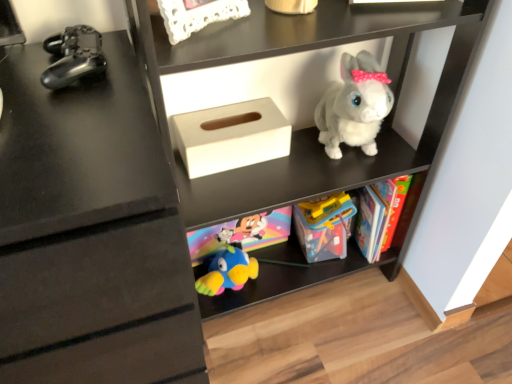
Question: Is white matte tissue box at center at the back of white matte plush rabbit at upper center?

Choices:
 (A) no
 (B) yes

Answer: (B)

Question: Is white matte plush rabbit at upper center touching white matte tissue box at center?

Choices:
 (A) yes
 (B) no

Answer: (B)

Question: Would you say white matte tissue box at center is part of white matte plush rabbit at upper center's contents?

Choices:
 (A) yes
 (B) no

Answer: (A)

Question: Is the position of white matte plush rabbit at upper center more distant than that of white matte tissue box at center?

Choices:
 (A) no
 (B) yes

Answer: (A)

Question: Can you confirm if white matte plush rabbit at upper center is bigger than white matte tissue box at center?

Choices:
 (A) yes
 (B) no

Answer: (A)

Question: From the image's perspective, relative to fluffy white plush rabbit at upper right, the 1th toy in the right-to-left sequence, is metallic black controller at left, marked as the first toy in a left-to-right arrangement, above or below?

Choices:
 (A) below
 (B) above

Answer: (B)

Question: Is metallic black controller at left, which appears as the 1th toy when viewed from the front, bigger or smaller than fluffy white plush rabbit at upper right, the 1th toy in the right-to-left sequence?

Choices:
 (A) small
 (B) big

Answer: (A)

Question: Does point (79, 49) appear closer or farther from the camera than point (361, 144)?

Choices:
 (A) farther
 (B) closer

Answer: (B)

Question: In terms of width, does metallic black controller at left, marked as the first toy in a left-to-right arrangement, look wider or thinner when compared to fluffy white plush rabbit at upper right, which appears as the 2th toy when viewed from the front?

Choices:
 (A) thin
 (B) wide

Answer: (A)

Question: Looking at their shapes, would you say translucent plastic toy at center, the 2th toy positioned from the left, is wider or thinner than metallic black controller at left, which is counted as the third toy, starting from the back?

Choices:
 (A) thin
 (B) wide

Answer: (A)

Question: Is translucent plastic toy at center, placed as the third toy when sorted from front to back, spatially inside metallic black controller at left, which appears as the 1th toy when viewed from the front, or outside of it?

Choices:
 (A) outside
 (B) inside

Answer: (A)

Question: From the image's perspective, relative to metallic black controller at left, which is the third toy from right to left, is translucent plastic toy at center, the 2th toy positioned from the left, above or below?

Choices:
 (A) above
 (B) below

Answer: (B)

Question: Considering the positions of point (334, 201) and point (69, 28), is point (334, 201) closer or farther from the camera than point (69, 28)?

Choices:
 (A) farther
 (B) closer

Answer: (A)

Question: In the image, is white matte plush rabbit at upper center positioned in front of or behind white matte tissue box at center?

Choices:
 (A) behind
 (B) front

Answer: (B)

Question: Would you say white matte plush rabbit at upper center is inside or outside white matte tissue box at center?

Choices:
 (A) outside
 (B) inside

Answer: (A)